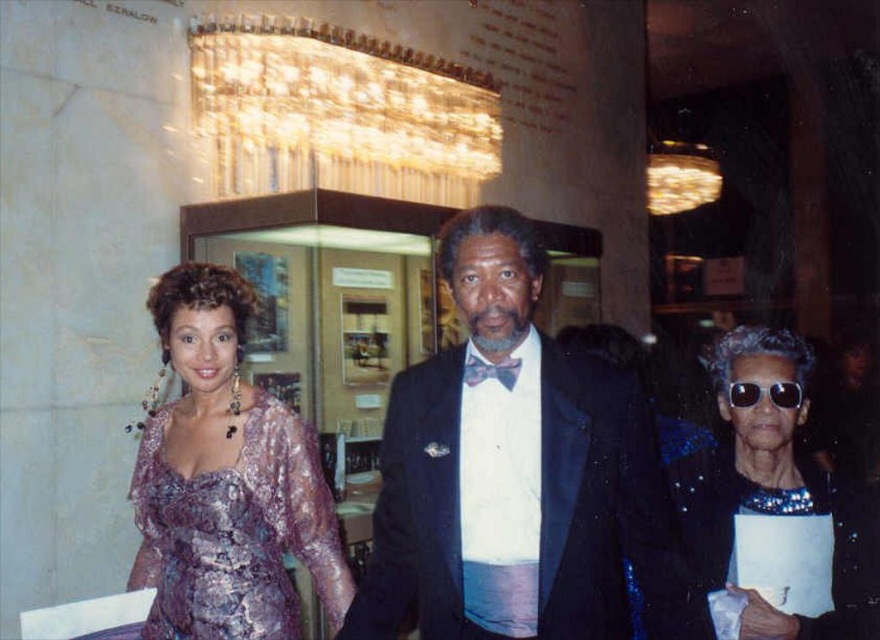
Question: Can you confirm if shiny purple dress at left is bigger than shiny sequined jacket at lower right?

Choices:
 (A) no
 (B) yes

Answer: (B)

Question: Does shiny purple dress at left have a smaller size compared to black reflective sunglasses at center?

Choices:
 (A) yes
 (B) no

Answer: (B)

Question: Among these objects, which one is farthest from the camera?

Choices:
 (A) metallic purple dress at left
 (B) shiny sequined jacket at lower right

Answer: (A)

Question: Which object appears closest to the camera in this image?

Choices:
 (A) shiny sequined jacket at lower right
 (B) shiny purple dress at left

Answer: (B)

Question: Estimate the real-world distances between objects in this image. Which object is closer to the shiny sequined jacket at lower right?

Choices:
 (A) shiny black suit at center
 (B) shiny purple dress at left

Answer: (B)

Question: Considering the relative positions of shiny purple dress at left and shiny sequined jacket at lower right in the image provided, where is shiny purple dress at left located with respect to shiny sequined jacket at lower right?

Choices:
 (A) left
 (B) right

Answer: (A)